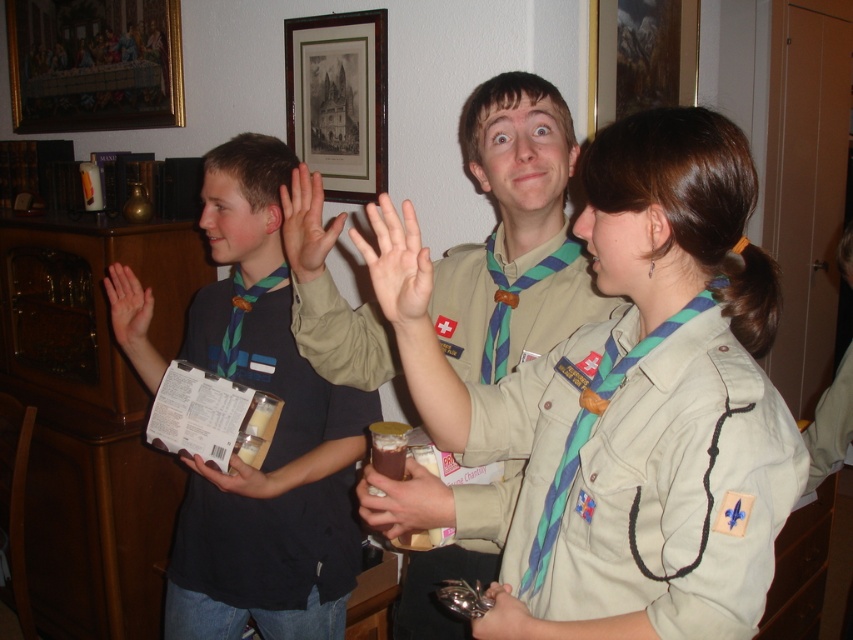
Question: Does matte black shirt at left have a lesser width compared to metallic silver scissors at lower center?

Choices:
 (A) no
 (B) yes

Answer: (A)

Question: Which object is the closest to the matte black hand at upper left?

Choices:
 (A) matte beige hand at center
 (B) khaki fabric uniform at center
 (C) metallic silver scissors at lower center
 (D) matte plastic cup at center

Answer: (D)

Question: Based on their relative distances, which object is farther from the matte plastic cup at center?

Choices:
 (A) matte beige hand at center
 (B) metallic silver scissors at lower center
 (C) matte black hand at upper left
 (D) khaki fabric uniform at center

Answer: (D)

Question: Which point appears farthest from the camera in this image?

Choices:
 (A) (x=250, y=480)
 (B) (x=521, y=611)
 (C) (x=306, y=208)

Answer: (A)

Question: Can you confirm if khaki fabric uniform at center is thinner than matte beige hand at center?

Choices:
 (A) yes
 (B) no

Answer: (B)

Question: Does beige uniform at center come behind matte black hand at upper left?

Choices:
 (A) no
 (B) yes

Answer: (A)